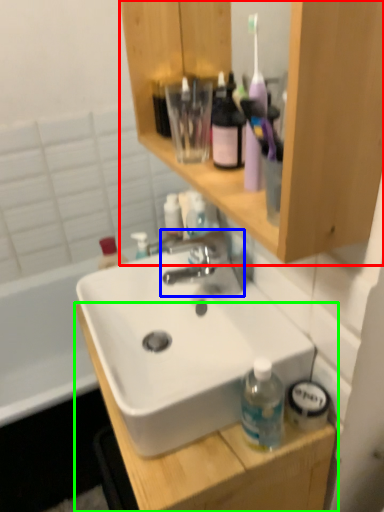
Question: Based on their relative distances, which object is farther from bathroom cabinet (highlighted by a red box)? Choose from tap (highlighted by a blue box) and cabinetry (highlighted by a green box).

Choices:
 (A) tap
 (B) cabinetry

Answer: (B)